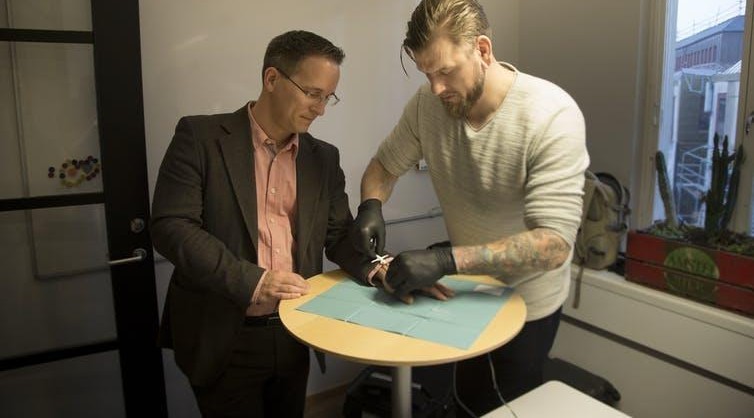
The image size is (754, 418). Identify the location of table. pos(372,342).